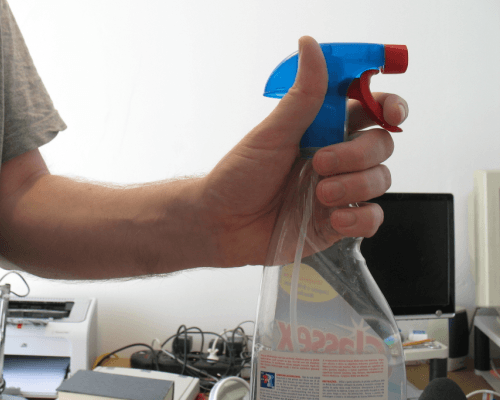
Identify the location of outlet. This screenshot has height=400, width=500. coord(158,356).